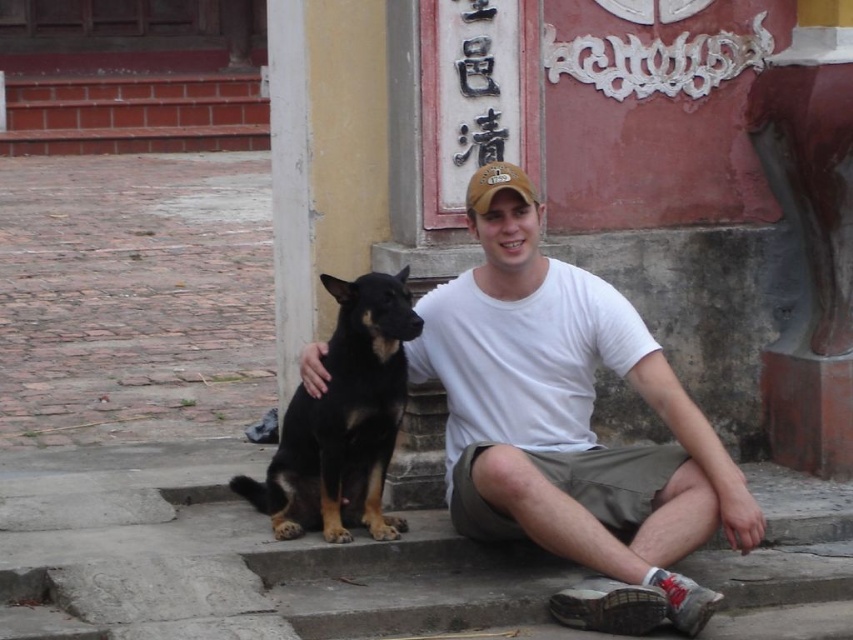
You are standing in front of the building with the red wall and want to take a photo of both the man and the black dog. You notice two specific points marked on the ground at coordinates point (239, 525) and point (659, 595). Which point should you stand closer to ensure both subjects are in focus?

You should stand closer to point (239, 525) because it is closer to the camera, allowing both the man and the dog to be in focus more easily.

You are a photographer trying to capture the man and his dog in the scene. The camera frame can only fit objects up to the size of the brown fabric cap at center. Will the black fur dog at center fit within the frame?

The black fur dog at center is larger in width than the brown fabric cap at center, so it will not fit within the camera frame designed for the cap size.